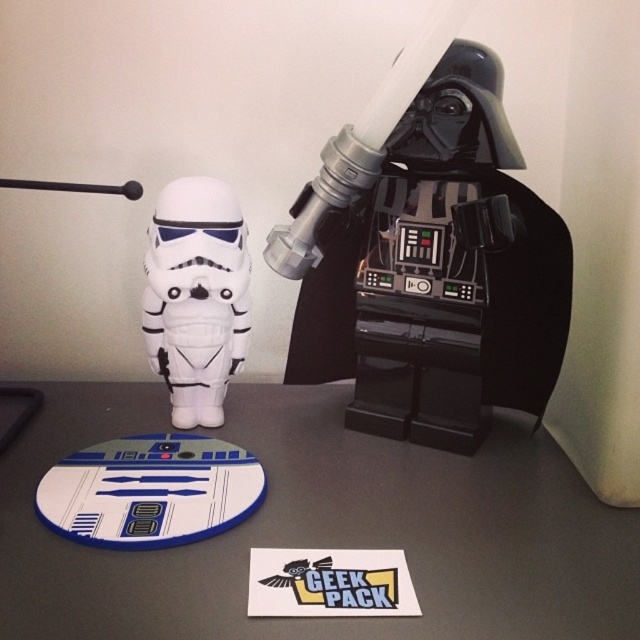
You are organizing a Star Wars display and need to place the white matte mouse pad at center and the white matte stormtrooper at center. According to the scene, where should you position the mouse pad relative to the stormtrooper?

The white matte mouse pad at center should be positioned below the white matte stormtrooper at center.

You are organizing a Star Wars display and need to place a new poster exactly at the center of the white matte mouse pad at center. Where should you place the poster?

The center of the white matte mouse pad at center is located at coordinate point (x=324, y=529), so place the poster there.